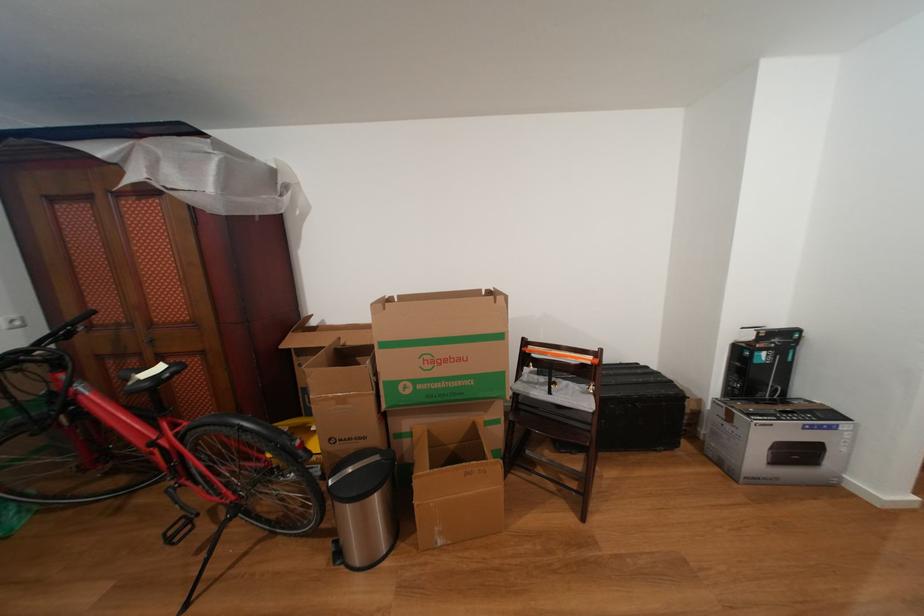
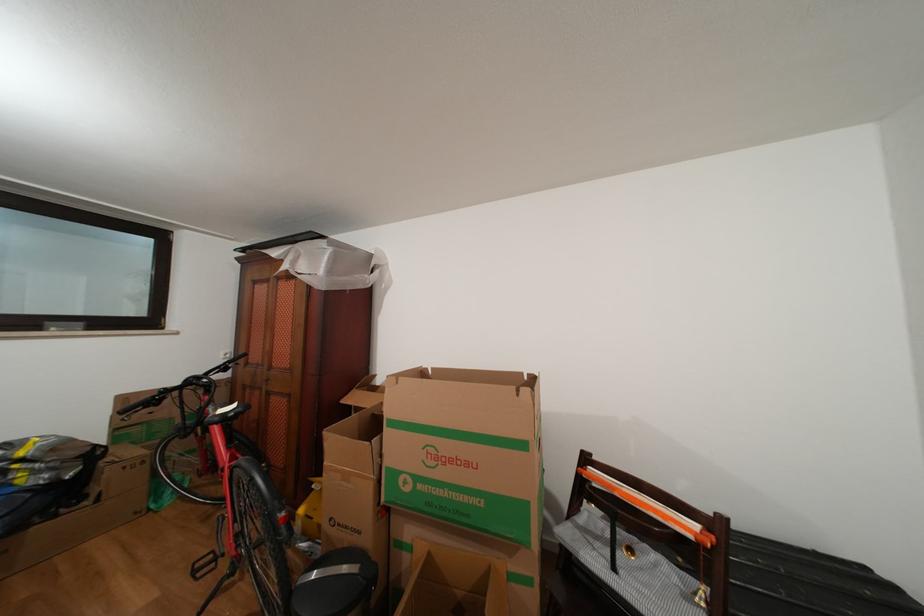
Question: The images are taken continuously from a first-person perspective. In which direction is your viewpoint rotating?

Choices:
 (A) Left
 (B) Right
 (C) Up
 (D) Down

Answer: (A)